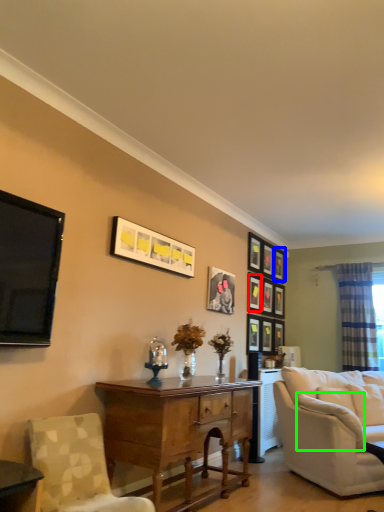
Question: Which is farther away from picture frame (highlighted by a red box)? picture frame (highlighted by a blue box) or pillow (highlighted by a green box)?

Choices:
 (A) picture frame
 (B) pillow

Answer: (B)